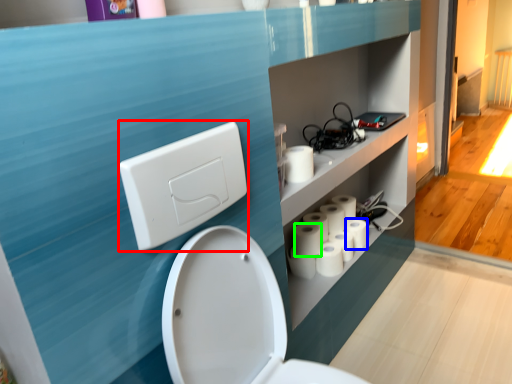
Question: Which object is positioned closest to light switch (highlighted by a red box)? Select from toilet paper (highlighted by a blue box) and toilet paper (highlighted by a green box).

Choices:
 (A) toilet paper
 (B) toilet paper

Answer: (B)